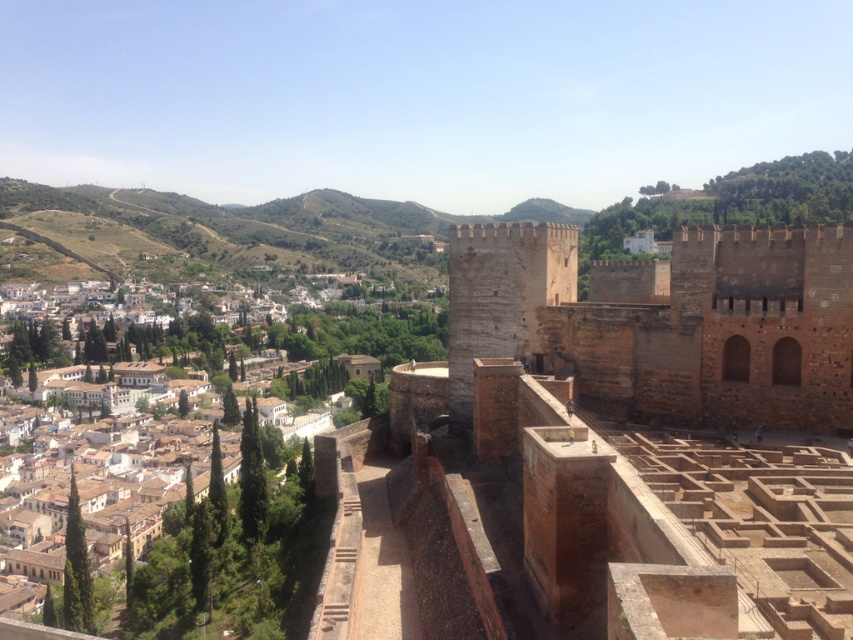
You are a city planner analyzing the layout of the fortress and the town. Given that the brown stone fort at center and the brown stone town at center are both central landmarks, which one has a smaller footprint in terms of width?

The brown stone fort at center has a smaller footprint in terms of width compared to the brown stone town at center, as stated in the description that the fort is less wide than the town.

You are an architect planning to build a new observation deck. You need to choose between placing it on the brown stone fort at center or the brown stone town at center. Which location offers more space for construction?

The brown stone town at center is larger than the brown stone fort at center, so the brown stone town at center offers more space for construction.

You are a drone operator who needs to fly a drone from the fortress to a point directly north. Given the coordinates of the brown stone fort at center, can you determine if the drone will have a clear path northward without obstacles?

The brown stone fort at center is located at coordinates point (606, 448). Since the fortress is in the foreground with stone walls and the urban sprawl is in the midground, the drone would likely encounter the urban buildings when moving north, so the path may not be clear.